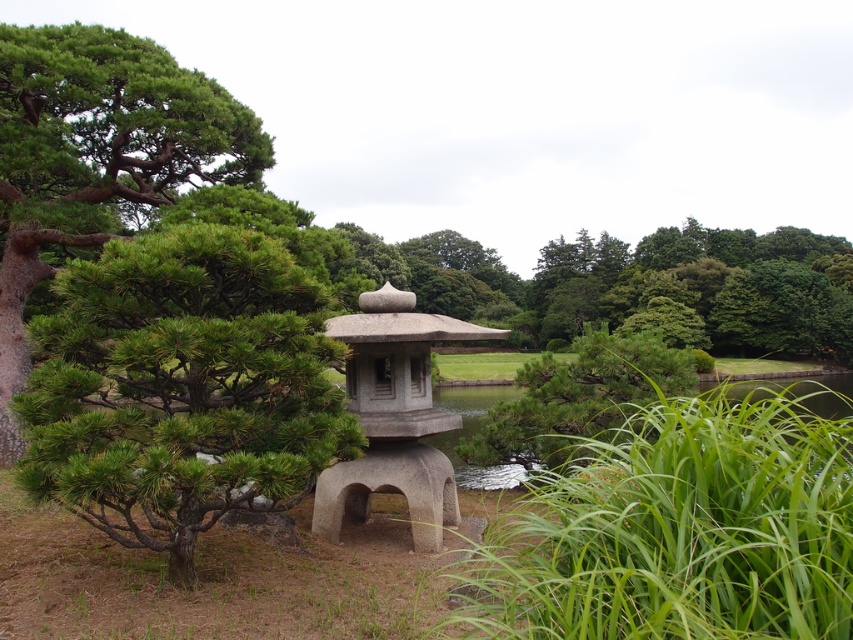
Question: Is green textured stone tree at left positioned in front of green textured pine tree at left?

Choices:
 (A) yes
 (B) no

Answer: (A)

Question: Which of the following is the farthest from the observer?

Choices:
 (A) (184, 416)
 (B) (445, 497)
 (C) (135, 161)

Answer: (C)

Question: Considering the relative positions of green textured stone tree at left and green textured pine tree at left in the image provided, where is green textured stone tree at left located with respect to green textured pine tree at left?

Choices:
 (A) right
 (B) left

Answer: (A)

Question: Which object is farther from the camera taking this photo?

Choices:
 (A) gray stone gazebo at center
 (B) green textured stone tree at left

Answer: (A)

Question: Is green textured stone tree at left further to camera compared to gray stone gazebo at center?

Choices:
 (A) no
 (B) yes

Answer: (A)

Question: Which point appears closest to the camera in this image?

Choices:
 (A) tap(402, 337)
 (B) tap(15, 156)
 (C) tap(45, 465)

Answer: (C)